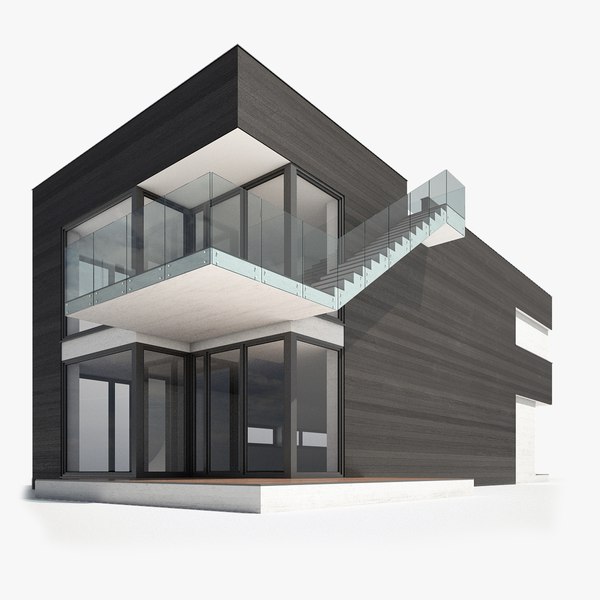
Find the location of a particular element. The image size is (600, 600). glass is located at coordinates (351, 254).